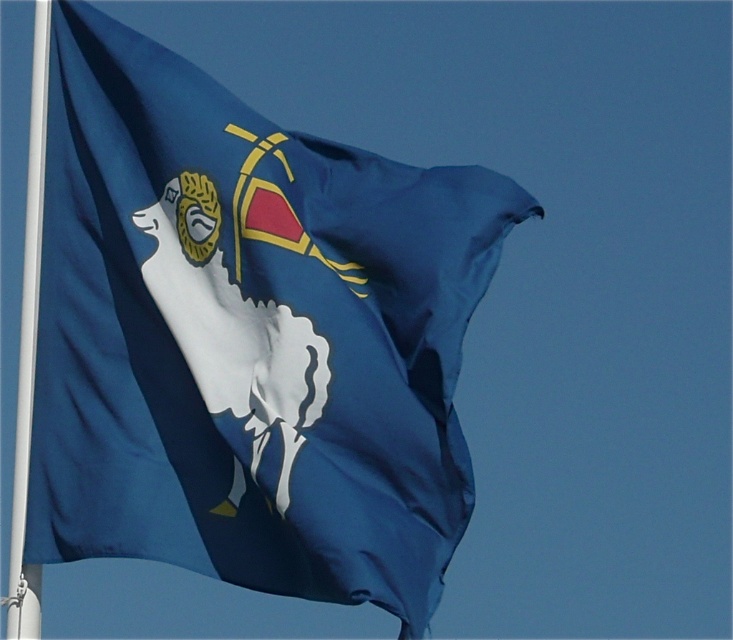
Question: Can you confirm if blue silk flag at center is smaller than white plastic pole at left?

Choices:
 (A) yes
 (B) no

Answer: (A)

Question: Does blue silk flag at center appear over white plastic pole at left?

Choices:
 (A) yes
 (B) no

Answer: (B)

Question: Which object is closer to the camera taking this photo?

Choices:
 (A) white plastic pole at left
 (B) blue silk flag at center

Answer: (B)

Question: Can you confirm if blue silk flag at center is smaller than white plastic pole at left?

Choices:
 (A) yes
 (B) no

Answer: (A)

Question: Among these points, which one is farthest from the camera?

Choices:
 (A) (379, 541)
 (B) (34, 332)

Answer: (B)

Question: Which point is closer to the camera?

Choices:
 (A) white plastic pole at left
 (B) blue silk flag at center

Answer: (B)